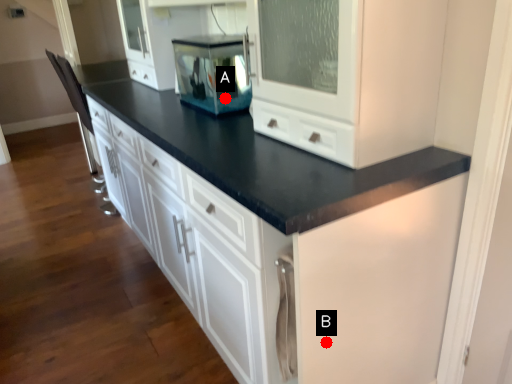
Question: Two points are circled on the image, labeled by A and B beside each circle. Which point appears farthest from the camera in this image?

Choices:
 (A) A is further
 (B) B is further

Answer: (A)